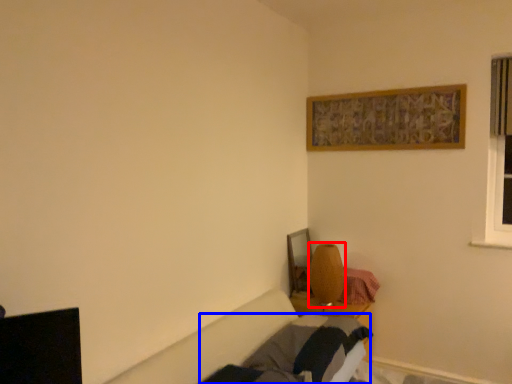
Question: Which object is closer to the camera taking this photo, table lamp (highlighted by a red box) or bed frame (highlighted by a blue box)?

Choices:
 (A) table lamp
 (B) bed frame

Answer: (B)